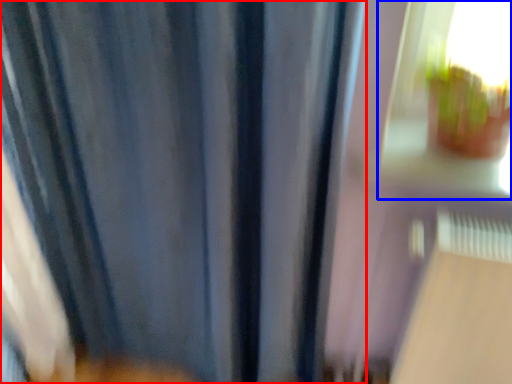
Question: Which of the following is the farthest to the observer, curtain (highlighted by a red box) or train window (highlighted by a blue box)?

Choices:
 (A) curtain
 (B) train window

Answer: (B)